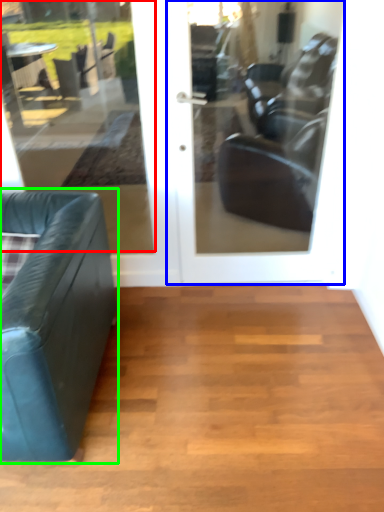
Question: Estimate the real-world distances between objects in this image. Which object is closer to window (highlighted by a red box), door (highlighted by a blue box) or studio couch (highlighted by a green box)?

Choices:
 (A) door
 (B) studio couch

Answer: (A)